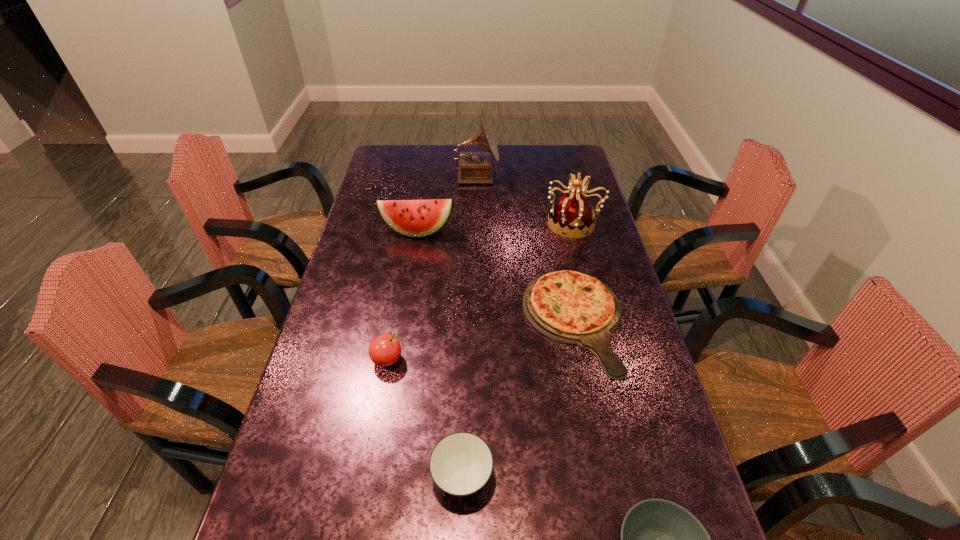
At what (x,y) coordinates should I click in order to perform the action: click on free spot between the apple and the third tallest object. Please return your answer as a coordinate pair (x, y). The image size is (960, 540). Looking at the image, I should click on (402, 295).

This screenshot has width=960, height=540. In order to click on the third closest object to the pizza in this screenshot , I will do `click(415, 218)`.

Locate which object ranks third in proximity to the apple. Please provide its 2D coordinates. Your answer should be formatted as a tuple, i.e. [(x, y)], where the tuple contains the x and y coordinates of a point satisfying the conditions above.

[(415, 218)]

I want to click on vacant space that satisfies the following two spatial constraints: 1. on the front-facing side of the second tallest object; 2. on the front side of the farther soup bowl, so click(x=637, y=477).

The height and width of the screenshot is (540, 960). In order to click on vacant space that satisfies the following two spatial constraints: 1. on the front-facing side of the tiara; 2. on the front side of the pizza in this screenshot , I will do `click(598, 321)`.

Where is `vacant region that satisfies the following two spatial constraints: 1. on the outer rind of the farther soup bowl; 2. on the right side of the watermelon`? Image resolution: width=960 pixels, height=540 pixels. vacant region that satisfies the following two spatial constraints: 1. on the outer rind of the farther soup bowl; 2. on the right side of the watermelon is located at coordinates (376, 477).

You are a GUI agent. You are given a task and a screenshot of the screen. Output one action in this format:
    pyautogui.click(x=<x>, y=<y>)
    Task: Click on the vacant position in the image that satisfies the following two spatial constraints: 1. on the back side of the apple; 2. on the left side of the shortest object
    The image size is (960, 540).
    Given the screenshot: What is the action you would take?
    pyautogui.click(x=395, y=321)

Where is `vacant space that satisfies the following two spatial constraints: 1. on the outer rind of the pizza; 2. on the left side of the fifth shortest object`? vacant space that satisfies the following two spatial constraints: 1. on the outer rind of the pizza; 2. on the left side of the fifth shortest object is located at coordinates (402, 321).